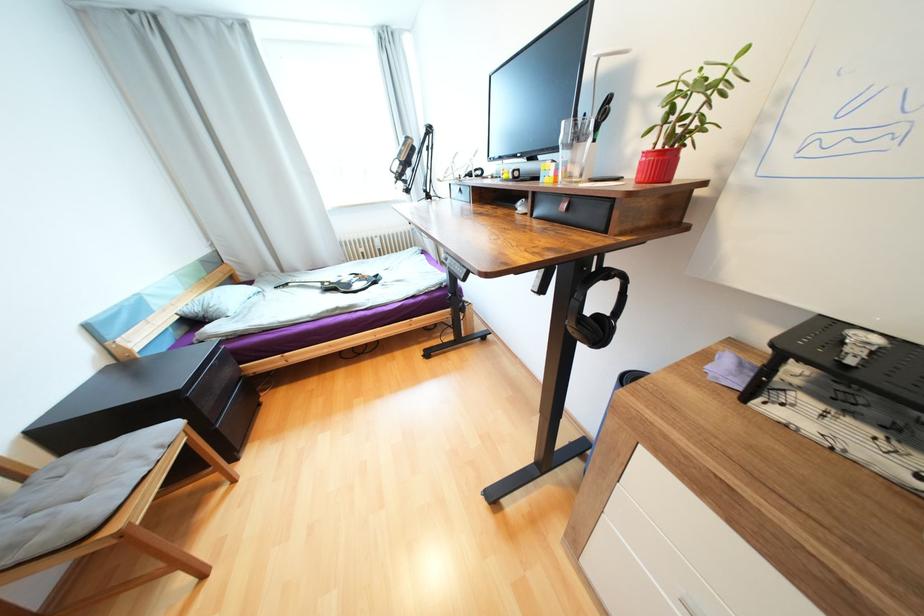
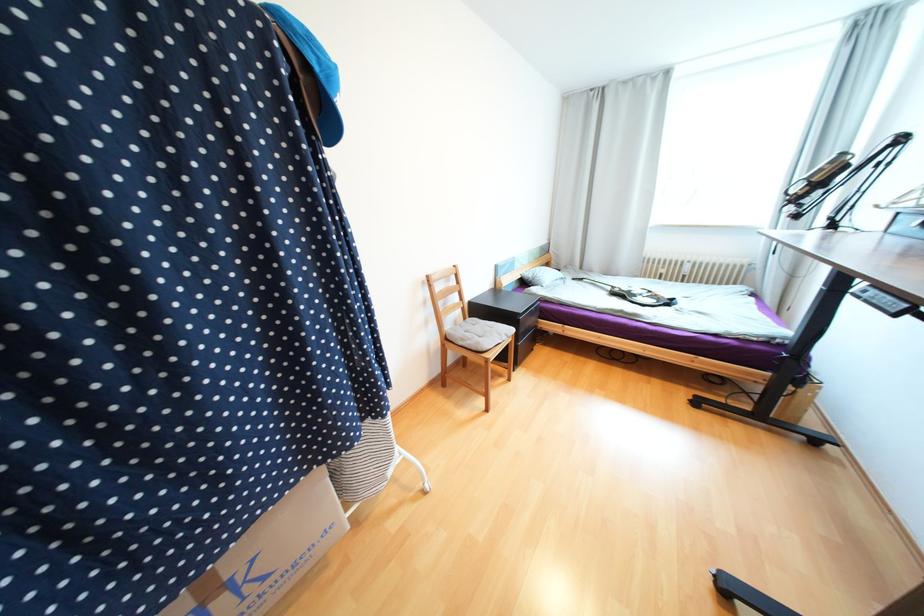
Find the pixel in the second image that matches point 212,310 in the first image.

(540, 278)